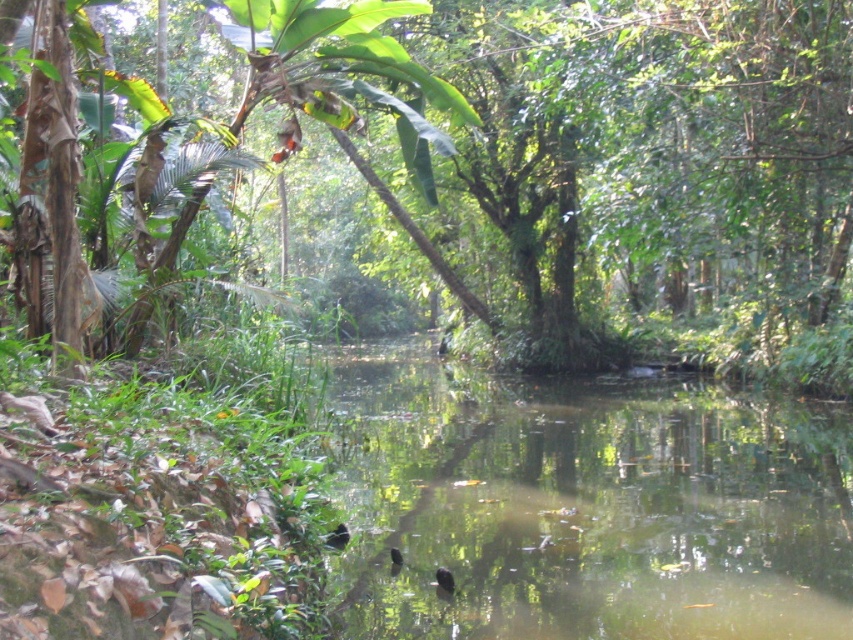
Question: Which object appears closest to the camera in this image?

Choices:
 (A) green reflective water at center
 (B) green leafy tree at center

Answer: (A)

Question: From the image, what is the correct spatial relationship of green reflective water at center in relation to green leafy tree at center?

Choices:
 (A) above
 (B) below

Answer: (B)

Question: Which of the following is the closest to the observer?

Choices:
 (A) (354, 474)
 (B) (502, 90)

Answer: (A)

Question: Considering the relative positions of green reflective water at center and green leafy tree at center in the image provided, where is green reflective water at center located with respect to green leafy tree at center?

Choices:
 (A) below
 (B) above

Answer: (A)

Question: From the image, what is the correct spatial relationship of green reflective water at center in relation to green leafy tree at center?

Choices:
 (A) left
 (B) right

Answer: (A)